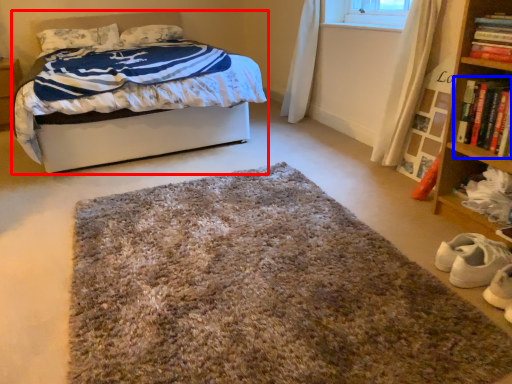
Question: Which object is further to the camera taking this photo, bed (highlighted by a red box) or book (highlighted by a blue box)?

Choices:
 (A) bed
 (B) book

Answer: (A)